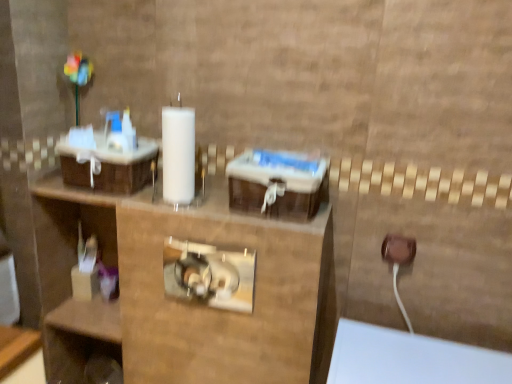
Question: Is brown plastic outlet at lower right wider than brown woven basket at left?

Choices:
 (A) no
 (B) yes

Answer: (A)

Question: From a real-world perspective, is brown plastic outlet at lower right located higher than brown woven basket at left?

Choices:
 (A) no
 (B) yes

Answer: (A)

Question: Does brown plastic outlet at lower right have a larger size compared to brown woven basket at left?

Choices:
 (A) yes
 (B) no

Answer: (B)

Question: Is brown plastic outlet at lower right to the left of brown woven basket at left from the viewer's perspective?

Choices:
 (A) no
 (B) yes

Answer: (A)

Question: Considering the relative sizes of brown plastic outlet at lower right and brown woven basket at left in the image provided, is brown plastic outlet at lower right shorter than brown woven basket at left?

Choices:
 (A) yes
 (B) no

Answer: (A)

Question: Is brown plastic outlet at lower right wider or thinner than translucent plastic container at lower left?

Choices:
 (A) thin
 (B) wide

Answer: (A)

Question: Is brown plastic outlet at lower right inside or outside of translucent plastic container at lower left?

Choices:
 (A) inside
 (B) outside

Answer: (B)

Question: Considering their positions, is brown plastic outlet at lower right located in front of or behind translucent plastic container at lower left?

Choices:
 (A) behind
 (B) front

Answer: (B)

Question: From the image's perspective, is brown plastic outlet at lower right positioned above or below translucent plastic container at lower left?

Choices:
 (A) above
 (B) below

Answer: (A)

Question: Does point (132, 180) appear closer or farther from the camera than point (394, 236)?

Choices:
 (A) farther
 (B) closer

Answer: (A)

Question: Is brown woven basket at left inside the boundaries of brown plastic outlet at lower right, or outside?

Choices:
 (A) inside
 (B) outside

Answer: (B)

Question: Looking at the image, does brown woven basket at left seem bigger or smaller compared to brown plastic outlet at lower right?

Choices:
 (A) big
 (B) small

Answer: (A)

Question: From a real-world perspective, is brown woven basket at left above or below brown plastic outlet at lower right?

Choices:
 (A) above
 (B) below

Answer: (A)

Question: Is brown plastic outlet at lower right taller or shorter than brown woven basket at left?

Choices:
 (A) short
 (B) tall

Answer: (A)

Question: Would you say brown plastic outlet at lower right is inside or outside brown woven basket at left?

Choices:
 (A) outside
 (B) inside

Answer: (A)